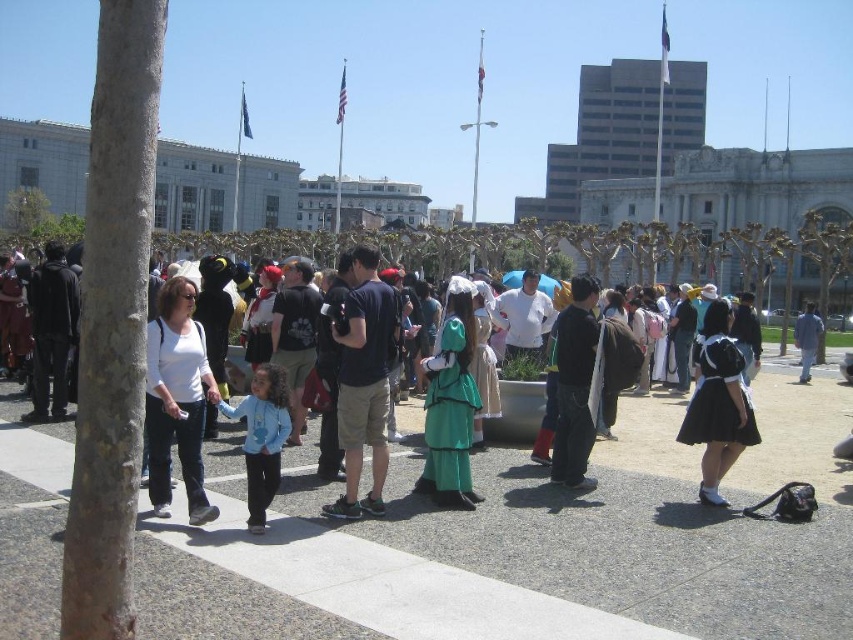
Is point (462, 387) farther from viewer compared to point (592, 291)?

No, it is not.

Which is in front, point (444, 380) or point (567, 401)?

Point (444, 380) is in front.

Is point (459, 296) farther from camera compared to point (579, 413)?

Yes, point (459, 296) is behind point (579, 413).

Locate an element on the screen. Image resolution: width=853 pixels, height=640 pixels. green satin dress at center is located at coordinates (450, 403).

Who is more forward, (392,336) or (296,257)?

Point (392,336)

Who is higher up, dark blue t-shirt at center or green fabric dress at center?

green fabric dress at center

You are a GUI agent. You are given a task and a screenshot of the screen. Output one action in this format:
    pyautogui.click(x=<x>, y=<y>)
    Task: Click on the dark blue t-shirt at center
    This screenshot has height=640, width=853.
    Given the screenshot: What is the action you would take?
    pyautogui.click(x=363, y=381)

This screenshot has width=853, height=640. Find the location of `dark blue t-shirt at center`. dark blue t-shirt at center is located at coordinates (363, 381).

Is white matte shirt at center shorter than blue denim jeans at right?

No.

Based on the photo, how far apart are white matte shirt at center and blue denim jeans at right?

white matte shirt at center is 162.06 feet away from blue denim jeans at right.

Is point (154, 508) farther from camera compared to point (801, 369)?

No.

Where is `white matte shirt at center`? white matte shirt at center is located at coordinates point(177,400).